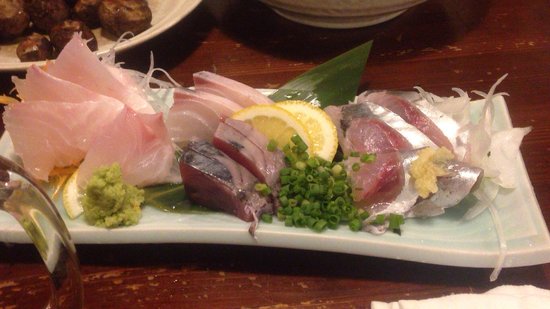
Find the location of a particular element. table is located at coordinates (443, 49).